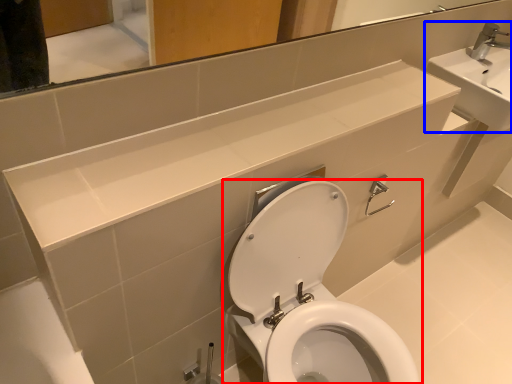
Question: Which of the following is the farthest to the observer, toilet (highlighted by a red box) or sink (highlighted by a blue box)?

Choices:
 (A) toilet
 (B) sink

Answer: (B)